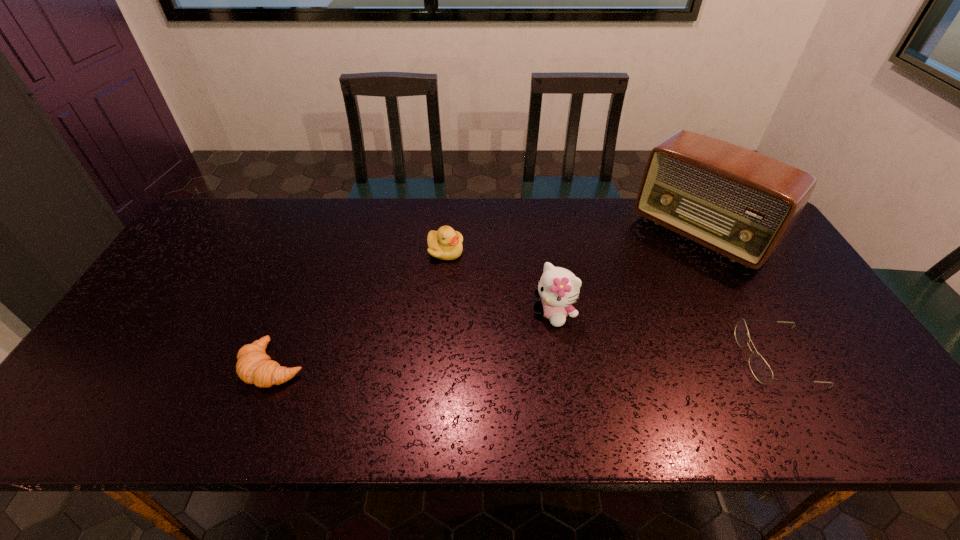
The width and height of the screenshot is (960, 540). I want to click on free space on the desktop that is between the crescent roll and the spectacles and is positioned on the front-facing side of the kitten, so click(x=507, y=361).

Find the location of a particular element. Image resolution: width=960 pixels, height=540 pixels. free space on the desktop that is between the crescent roll and the spectacles and is positioned on the beak of the third tallest object is located at coordinates (489, 362).

Image resolution: width=960 pixels, height=540 pixels. In order to click on vacant space on the desktop that is between the crescent roll and the spectacles and is positioned on the front-facing side of the tallest object in this screenshot , I will do `click(572, 360)`.